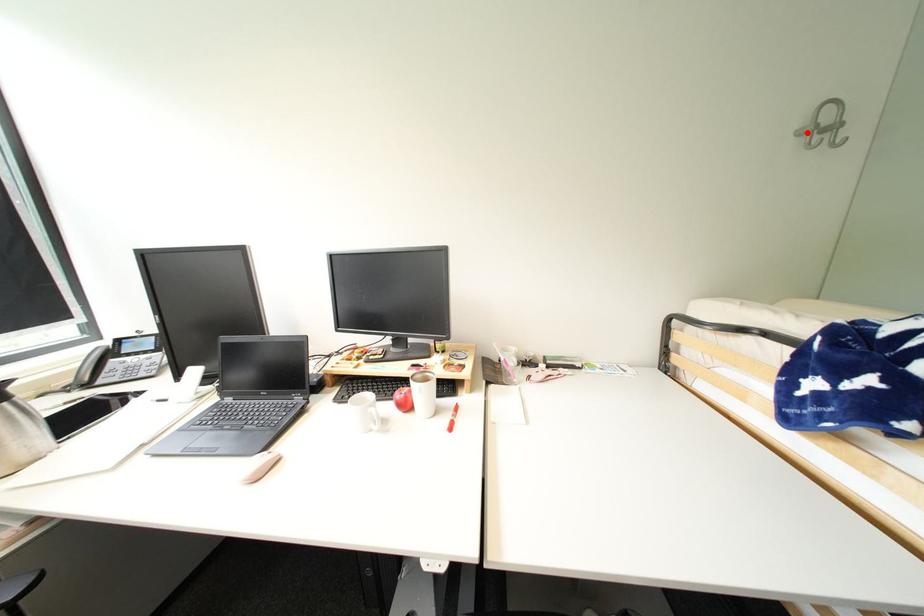
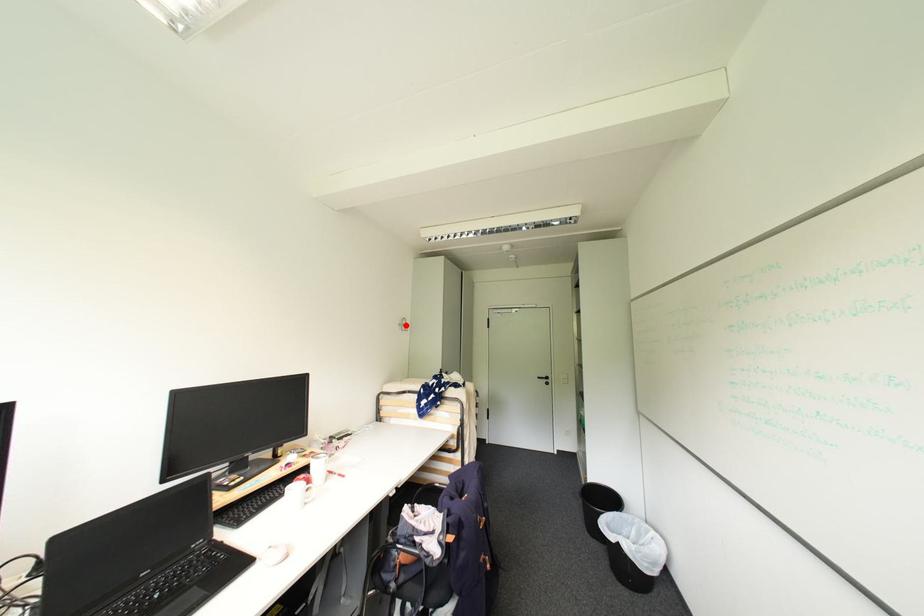
I am providing you with two images of the same scene from different viewpoints. A red point is marked on the first image and another point is marked on the second image. Do the highlighted points in image1 and image2 indicate the same real-world spot?

Yes